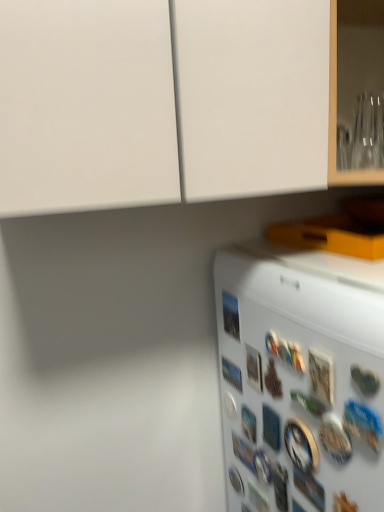
The image size is (384, 512). What do you see at coordinates (335, 438) in the screenshot?
I see `metallic silver button at lower right, the twelfth button in the back-to-front sequence` at bounding box center [335, 438].

Find the location of `metallic silver button at lower right, which is the tenth button in back-to-front order`. metallic silver button at lower right, which is the tenth button in back-to-front order is located at coordinates (309, 488).

Locate an element on the screen. metallic silver button at lower right, the 11th button in the back-to-front sequence is located at coordinates (321, 376).

Identify the location of metallic silver button at lower center, which appears as the 13th button when viewed from the front. coord(236,480).

Which is behind, point (341, 431) or point (272, 442)?

The point (272, 442) is farther.

Is metallic silver button at lower right, the twelfth button in the back-to-front sequence, outside of blue plastic button at lower right, the 9th button in the back-to-front sequence?

Yes, metallic silver button at lower right, the twelfth button in the back-to-front sequence, is not within blue plastic button at lower right, the 9th button in the back-to-front sequence.

Consider the image. Is metallic silver button at lower right, the twelfth button in the back-to-front sequence, oriented towards blue plastic button at lower right, the 9th button in the back-to-front sequence?

No, metallic silver button at lower right, the twelfth button in the back-to-front sequence, is not oriented towards blue plastic button at lower right, the 9th button in the back-to-front sequence.

Can you confirm if metallic photo at right, the seventh button from the back, is wider than metallic silver button at lower right, the 3th button from the front?

No, metallic photo at right, the seventh button from the back, is not wider than metallic silver button at lower right, the 3th button from the front.

From the image's perspective, which one is positioned higher, metallic photo at right, the seventh button from the back, or metallic silver button at lower right, the 3th button from the front?

metallic photo at right, the seventh button from the back, from the image's perspective.

From the picture: Considering the sizes of objects metallic photo at right, the seventh button from the back, and blue glossy button at lower center, which appears as the eighth button when viewed from the front, in the image provided, who is wider, metallic photo at right, the seventh button from the back, or blue glossy button at lower center, which appears as the eighth button when viewed from the front,?

Wider between the two is blue glossy button at lower center, which appears as the eighth button when viewed from the front.

Choose the correct answer: Is metallic photo at right, arranged as the seventh button when viewed from the front, inside blue glossy button at lower center, which appears as the eighth button when viewed from the front, or outside it?

metallic photo at right, arranged as the seventh button when viewed from the front, cannot be found inside blue glossy button at lower center, which appears as the eighth button when viewed from the front.

Measure the distance from metallic silver button at lower right, arranged as the eleventh button when viewed from the front, to metallic silver button at lower right, the eighth button viewed from the back.

The distance of metallic silver button at lower right, arranged as the eleventh button when viewed from the front, from metallic silver button at lower right, the eighth button viewed from the back, is 7.64 inches.

Is metallic silver button at lower right, arranged as the eleventh button when viewed from the front, further to camera compared to metallic silver button at lower right, arranged as the sixth button when viewed from the front?

Yes, the depth of metallic silver button at lower right, arranged as the eleventh button when viewed from the front, is greater than that of metallic silver button at lower right, arranged as the sixth button when viewed from the front.

Is there a large distance between metallic silver button at lower right, arranged as the eleventh button when viewed from the front, and metallic silver button at lower right, arranged as the sixth button when viewed from the front?

metallic silver button at lower right, arranged as the eleventh button when viewed from the front, is near metallic silver button at lower right, arranged as the sixth button when viewed from the front, not far away.

Is metallic silver button at lower right, arranged as the eleventh button when viewed from the front, aimed at metallic silver button at lower right, arranged as the sixth button when viewed from the front?

No, metallic silver button at lower right, arranged as the eleventh button when viewed from the front, is not aimed at metallic silver button at lower right, arranged as the sixth button when viewed from the front.

Considering the sizes of objects metallic silver button at lower right, the twelfth button in the back-to-front sequence, and white matte refrigerator at lower right in the image provided, who is shorter, metallic silver button at lower right, the twelfth button in the back-to-front sequence, or white matte refrigerator at lower right?

With less height is metallic silver button at lower right, the twelfth button in the back-to-front sequence.

Looking at this image, is metallic silver button at lower right, the 2th button in the front-to-back sequence, turned away from white matte refrigerator at lower right?

Yes, white matte refrigerator at lower right is at the back of metallic silver button at lower right, the 2th button in the front-to-back sequence.

Considering the sizes of objects metallic silver button at lower right, the twelfth button in the back-to-front sequence, and white matte refrigerator at lower right in the image provided, who is smaller, metallic silver button at lower right, the twelfth button in the back-to-front sequence, or white matte refrigerator at lower right?

Smaller between the two is metallic silver button at lower right, the twelfth button in the back-to-front sequence.

What's the angular difference between blue glossy button at lower right, acting as the 13th button starting from the back, and metallic silver button at lower right, the 11th button in the back-to-front sequence,'s facing directions?

There is a 1.16-degree angle between the facing directions of blue glossy button at lower right, acting as the 13th button starting from the back, and metallic silver button at lower right, the 11th button in the back-to-front sequence.

Which object is positioned more to the right, blue glossy button at lower right, placed as the 1th button when sorted from front to back, or metallic silver button at lower right, the 11th button in the back-to-front sequence?

Positioned to the right is blue glossy button at lower right, placed as the 1th button when sorted from front to back.

Is blue glossy button at lower right, acting as the 13th button starting from the back, not near metallic silver button at lower right, the 11th button in the back-to-front sequence?

Actually, blue glossy button at lower right, acting as the 13th button starting from the back, and metallic silver button at lower right, the 11th button in the back-to-front sequence, are a little close together.

Image resolution: width=384 pixels, height=512 pixels. What are the coordinates of `button that is the 2nd object located behind the blue glossy button at lower right, acting as the 13th button starting from the back` in the screenshot? It's located at (321, 376).

Is metallic photo at right, arranged as the seventh button when viewed from the front, next to metallic silver button at lower right, arranged as the sixth button when viewed from the front, and touching it?

Absolutely, metallic photo at right, arranged as the seventh button when viewed from the front, is next to and touching metallic silver button at lower right, arranged as the sixth button when viewed from the front.

Which is less distant, (224,298) or (257,389)?

Positioned in front is point (257,389).

Is metallic photo at right, arranged as the seventh button when viewed from the front, smaller than metallic silver button at lower right, the eighth button viewed from the back?

Indeed, metallic photo at right, arranged as the seventh button when viewed from the front, has a smaller size compared to metallic silver button at lower right, the eighth button viewed from the back.

From their relative heights in the image, would you say metallic photo at right, the seventh button from the back, is taller or shorter than metallic silver button at lower right, arranged as the sixth button when viewed from the front?

Clearly, metallic photo at right, the seventh button from the back, is taller compared to metallic silver button at lower right, arranged as the sixth button when viewed from the front.

From the blue plastic button at lower right, the 9th button in the back-to-front sequence, count 3rd buttons forward and point to it. Please provide its 2D coordinates.

[(335, 438)]

There is a metallic silver button at lower right, the 11th button in the back-to-front sequence. What are the coordinates of `button above it (from a real-world perspective)` in the screenshot? It's located at (231, 315).

Which object lies further to the anchor point metallic photo at right, the seventh button from the back, metallic silver button at lower center, which appears as the 13th button when viewed from the front, or metallic silver button at lower right, arranged as the sixth button when viewed from the front?

Based on the image, metallic silver button at lower center, which appears as the 13th button when viewed from the front, appears to be further to metallic photo at right, the seventh button from the back.

When comparing their distances from metallic photo at right, the seventh button from the back, does metallic silver button at lower right, the 11th button in the back-to-front sequence, or blue glossy button at lower center, which appears as the eighth button when viewed from the front, seem closer?

blue glossy button at lower center, which appears as the eighth button when viewed from the front, is closer to metallic photo at right, the seventh button from the back.

When comparing their distances from blue glossy button at lower right, acting as the 13th button starting from the back, does blue glossy button at lower center, the sixth button positioned from the back, or metallic silver button at lower right, the 11th button in the back-to-front sequence, seem further?

blue glossy button at lower center, the sixth button positioned from the back, is positioned further to the anchor blue glossy button at lower right, acting as the 13th button starting from the back.

Considering their positions, is metallic silver button at lower right, the eighth button viewed from the back, positioned closer to metallic silver button at lower right, which is counted as the 4th button, starting from the front, than white plastic button at lower right, which is the fifth button from back to front?

white plastic button at lower right, which is the fifth button from back to front, is positioned closer to the anchor metallic silver button at lower right, which is counted as the 4th button, starting from the front.

Based on their spatial positions, is metallic silver button at lower right, the 3th button from the front, or blue glossy button at lower right, placed as the 1th button when sorted from front to back, further from white matte refrigerator at lower right?

blue glossy button at lower right, placed as the 1th button when sorted from front to back, is positioned further to the anchor white matte refrigerator at lower right.

Estimate the real-world distances between objects in this image. Which object is further from blue glossy button at lower right, acting as the 13th button starting from the back, metallic silver button at lower right, the 3th button from the front, or white matte cabinet doors at upper center?

Based on the image, white matte cabinet doors at upper center appears to be further to blue glossy button at lower right, acting as the 13th button starting from the back.

From the image, which object appears to be farther from white plastic button at lower right, which is the fifth button from back to front, metallic silver button at lower right, which is the tenth button in back-to-front order, or metallic blue magnet at lower center, the 10th button viewed from the front?

metallic blue magnet at lower center, the 10th button viewed from the front, lies further to white plastic button at lower right, which is the fifth button from back to front, than the other object.

Based on their spatial positions, is metallic silver button at lower right, the 3th button from the front, or metallic silver button at lower center, which appears as the first button when viewed from the back, further from metallic silver button at lower right, which is counted as the 4th button, starting from the front?

metallic silver button at lower center, which appears as the first button when viewed from the back.

You are a GUI agent. You are given a task and a screenshot of the screen. Output one action in this format:
    pyautogui.click(x=<x>, y=<y>)
    Task: Click on the refrigerator between white matte cabinet doors at upper center and blue glossy button at lower center, which appears as the eighth button when viewed from the front, in the up-down direction
    The image size is (384, 512).
    Given the screenshot: What is the action you would take?
    pyautogui.click(x=303, y=369)

This screenshot has height=512, width=384. I want to click on refrigerator between white matte cabinet doors at upper center and metallic silver button at lower right, arranged as the eleventh button when viewed from the front, in the vertical direction, so click(303, 369).

Where is `refrigerator that lies between metallic photo at right, arranged as the seventh button when viewed from the front, and white plastic button at lower right, which is the fifth button from back to front, from top to bottom`? The height and width of the screenshot is (512, 384). refrigerator that lies between metallic photo at right, arranged as the seventh button when viewed from the front, and white plastic button at lower right, which is the fifth button from back to front, from top to bottom is located at coordinates (303, 369).

Where is `button between white matte cabinet doors at upper center and metallic silver button at lower right, the 11th button in the back-to-front sequence, vertically`? Image resolution: width=384 pixels, height=512 pixels. button between white matte cabinet doors at upper center and metallic silver button at lower right, the 11th button in the back-to-front sequence, vertically is located at coordinates (231, 315).